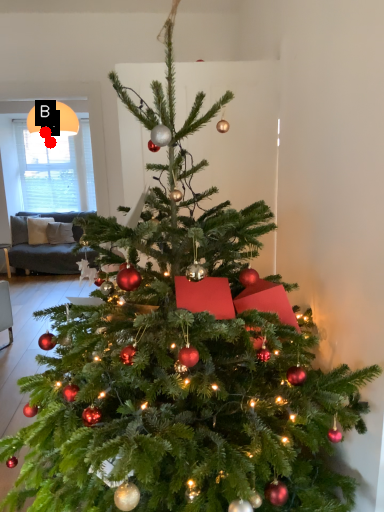
Question: Two points are circled on the image, labeled by A and B beside each circle. Among these points, which one is farthest from the camera?

Choices:
 (A) A is further
 (B) B is further

Answer: (A)